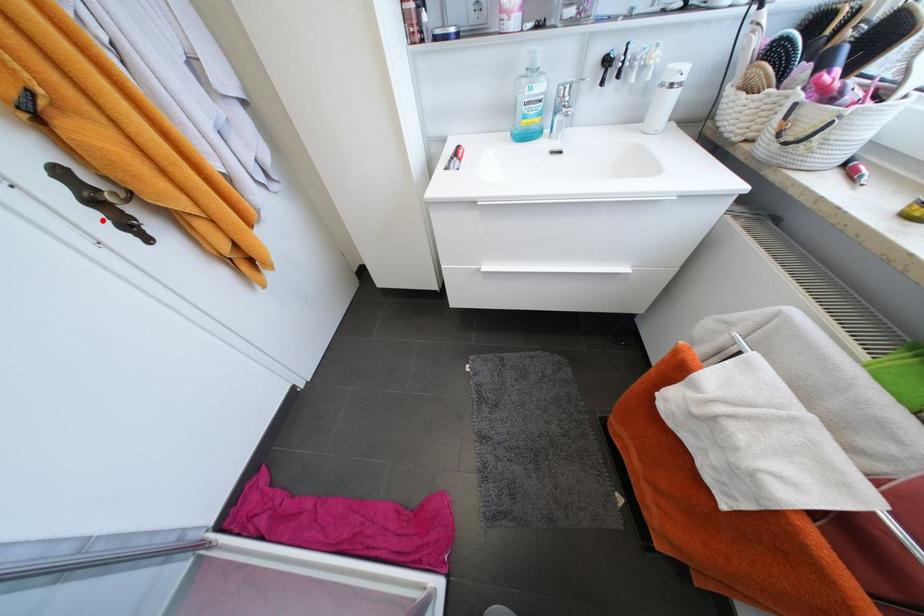
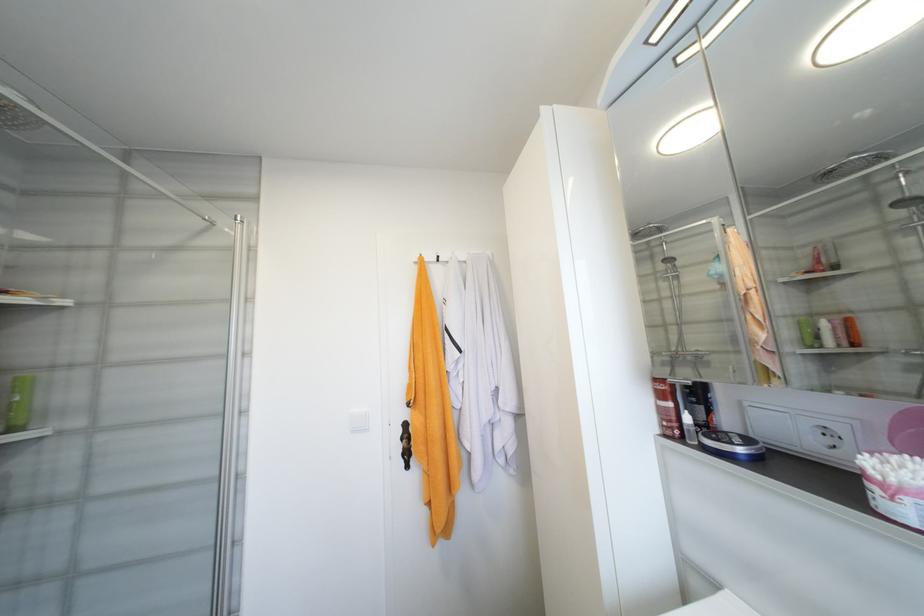
Find the pixel in the second image that matches the highlighted location in the first image.

(405, 448)